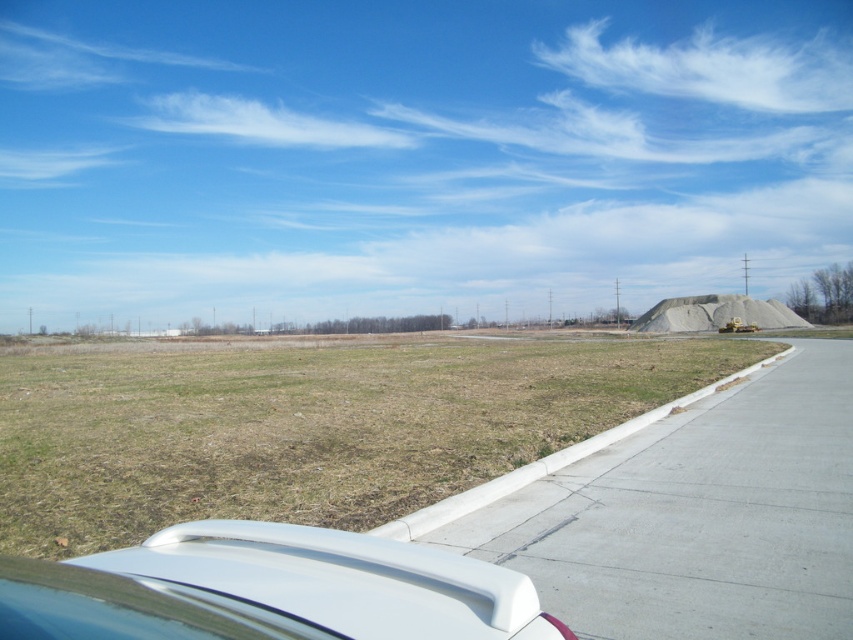
Question: Among these points, which one is nearest to the camera?

Choices:
 (A) (166, 564)
 (B) (434, 508)

Answer: (A)

Question: Can you confirm if green grass at lower left is thinner than white matte spoiler at lower center?

Choices:
 (A) no
 (B) yes

Answer: (A)

Question: Which is farther from the gray gravel pile at right?

Choices:
 (A) concrete at right
 (B) green grass at lower left
 (C) white matte spoiler at lower center

Answer: (C)

Question: Does green grass at lower left have a lesser width compared to white matte spoiler at lower center?

Choices:
 (A) no
 (B) yes

Answer: (A)

Question: Among these points, which one is nearest to the camera?

Choices:
 (A) [711, 307]
 (B) [277, 532]

Answer: (B)

Question: Is white matte spoiler at lower center below concrete at right?

Choices:
 (A) yes
 (B) no

Answer: (B)